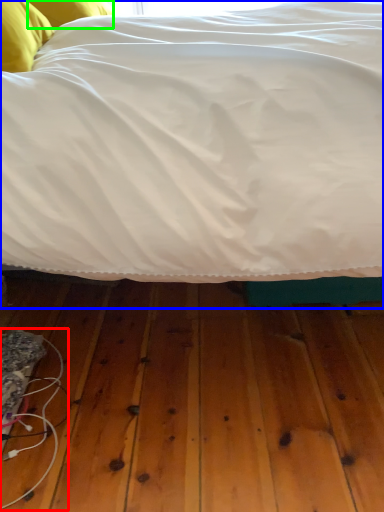
Question: Considering the real-world distances, which object is farthest from wire (highlighted by a red box)? bed (highlighted by a blue box) or pillow (highlighted by a green box)?

Choices:
 (A) bed
 (B) pillow

Answer: (B)